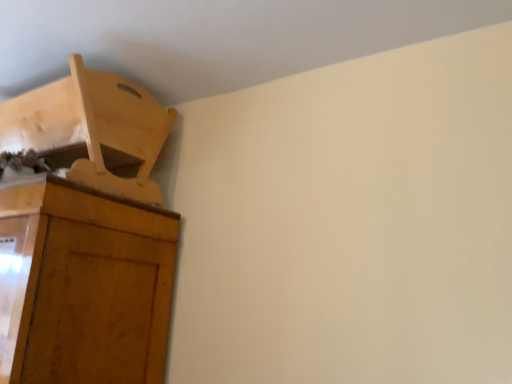
What is the approximate height of light wood chair at upper left?

light wood chair at upper left is 20.03 inches tall.

You are a GUI agent. You are given a task and a screenshot of the screen. Output one action in this format:
    pyautogui.click(x=<x>, y=<y>)
    Task: Click on the light wood chair at upper left
    This screenshot has width=512, height=384.
    Given the screenshot: What is the action you would take?
    pyautogui.click(x=92, y=130)

What do you see at coordinates (92, 130) in the screenshot?
I see `light wood chair at upper left` at bounding box center [92, 130].

Image resolution: width=512 pixels, height=384 pixels. Describe the element at coordinates (86, 235) in the screenshot. I see `wooden cupboard at upper left` at that location.

The height and width of the screenshot is (384, 512). In order to click on wooden cupboard at upper left in this screenshot , I will do `click(86, 235)`.

Identify the location of light wood chair at upper left. Image resolution: width=512 pixels, height=384 pixels. tap(92, 130).

Considering the positions of objects wooden cupboard at upper left and light wood chair at upper left in the image provided, who is more to the right, wooden cupboard at upper left or light wood chair at upper left?

light wood chair at upper left is more to the right.

Consider the image. Which is behind, wooden cupboard at upper left or light wood chair at upper left?

light wood chair at upper left.

Which is in front, point (177, 226) or point (59, 126)?

The point (59, 126) is closer.

From the picture: From the image's perspective, is wooden cupboard at upper left located above or below light wood chair at upper left?

Based on their image positions, wooden cupboard at upper left is located beneath light wood chair at upper left.

From a real-world perspective, who is located higher, wooden cupboard at upper left or light wood chair at upper left?

light wood chair at upper left is physically above.

Considering the sizes of objects wooden cupboard at upper left and light wood chair at upper left in the image provided, who is thinner, wooden cupboard at upper left or light wood chair at upper left?

Thinner between the two is light wood chair at upper left.

Who is shorter, wooden cupboard at upper left or light wood chair at upper left?

With less height is light wood chair at upper left.

Considering the sizes of objects wooden cupboard at upper left and light wood chair at upper left in the image provided, who is smaller, wooden cupboard at upper left or light wood chair at upper left?

light wood chair at upper left.

Is wooden cupboard at upper left not inside light wood chair at upper left?

Yes, wooden cupboard at upper left is not within light wood chair at upper left.

Is wooden cupboard at upper left far from light wood chair at upper left?

They are positioned close to each other.

In the scene shown: Is light wood chair at upper left at the back of wooden cupboard at upper left?

That's not correct — wooden cupboard at upper left is not looking away from light wood chair at upper left.

How different are the orientations of wooden cupboard at upper left and light wood chair at upper left in degrees?

The angle between the facing direction of wooden cupboard at upper left and the facing direction of light wood chair at upper left is 2.44 degrees.

How distant is wooden cupboard at upper left from light wood chair at upper left?

wooden cupboard at upper left is 4.24 inches away from light wood chair at upper left.

Where is `cupboard in front of the light wood chair at upper left`? Image resolution: width=512 pixels, height=384 pixels. cupboard in front of the light wood chair at upper left is located at coordinates (86, 235).

Which object is positioned more to the right, light wood chair at upper left or wooden cupboard at upper left?

From the viewer's perspective, light wood chair at upper left appears more on the right side.

Considering the positions of objects light wood chair at upper left and wooden cupboard at upper left in the image provided, who is behind, light wood chair at upper left or wooden cupboard at upper left?

Positioned behind is light wood chair at upper left.

Is point (55, 94) positioned before point (106, 184)?

No.

From the image's perspective, is light wood chair at upper left positioned above or below wooden cupboard at upper left?

Clearly, from the image's perspective, light wood chair at upper left is above wooden cupboard at upper left.

From a real-world perspective, who is located lower, light wood chair at upper left or wooden cupboard at upper left?

In real-world perspective, wooden cupboard at upper left is lower.

In terms of width, does light wood chair at upper left look wider or thinner when compared to wooden cupboard at upper left?

Considering their sizes, light wood chair at upper left looks slimmer than wooden cupboard at upper left.

Considering the sizes of objects light wood chair at upper left and wooden cupboard at upper left in the image provided, who is shorter, light wood chair at upper left or wooden cupboard at upper left?

With less height is light wood chair at upper left.

Does light wood chair at upper left have a larger size compared to wooden cupboard at upper left?

Incorrect, light wood chair at upper left is not larger than wooden cupboard at upper left.

In the scene shown: Is light wood chair at upper left inside the boundaries of wooden cupboard at upper left, or outside?

The correct answer is: outside.

Is light wood chair at upper left far from wooden cupboard at upper left?

No, light wood chair at upper left is not far from wooden cupboard at upper left.

Is light wood chair at upper left oriented towards wooden cupboard at upper left?

No, light wood chair at upper left is not turned towards wooden cupboard at upper left.

How many degrees apart are the facing directions of light wood chair at upper left and wooden cupboard at upper left?

The angular difference between light wood chair at upper left and wooden cupboard at upper left is 2.44 degrees.

Find the location of `cupboard below the light wood chair at upper left (from the image's perspective)`. cupboard below the light wood chair at upper left (from the image's perspective) is located at coordinates (86, 235).

This screenshot has height=384, width=512. In order to click on cupboard on the left of the light wood chair at upper left in this screenshot , I will do `click(86, 235)`.

Find the location of a particular element. The width and height of the screenshot is (512, 384). cupboard that appears below the light wood chair at upper left (from a real-world perspective) is located at coordinates (86, 235).